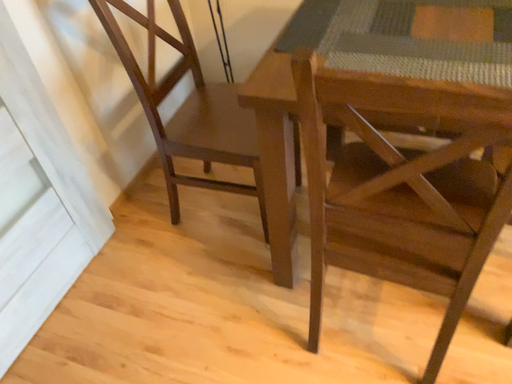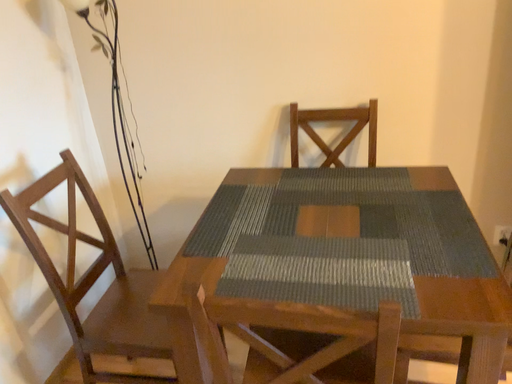
Question: How did the camera likely rotate when shooting the video?

Choices:
 (A) rotated left
 (B) rotated right

Answer: (B)